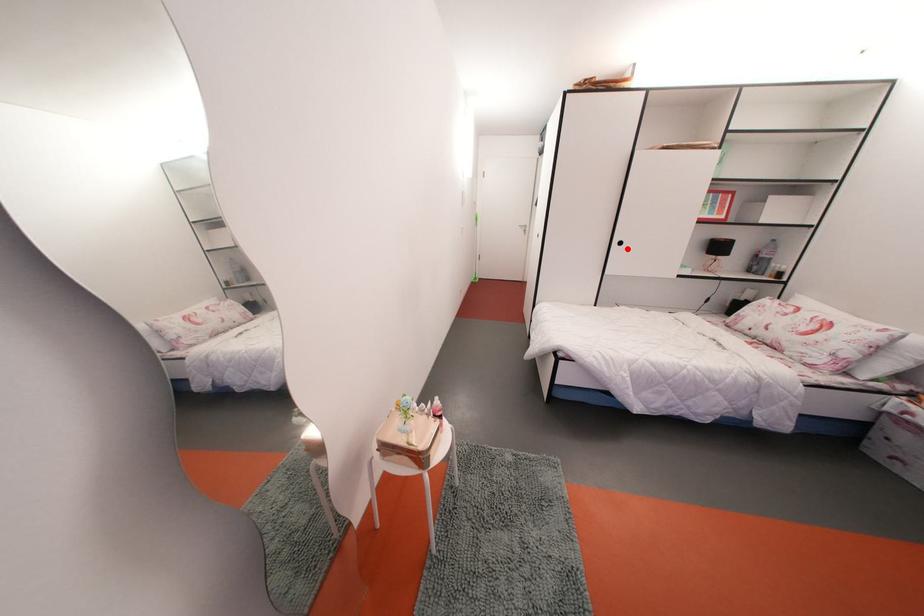
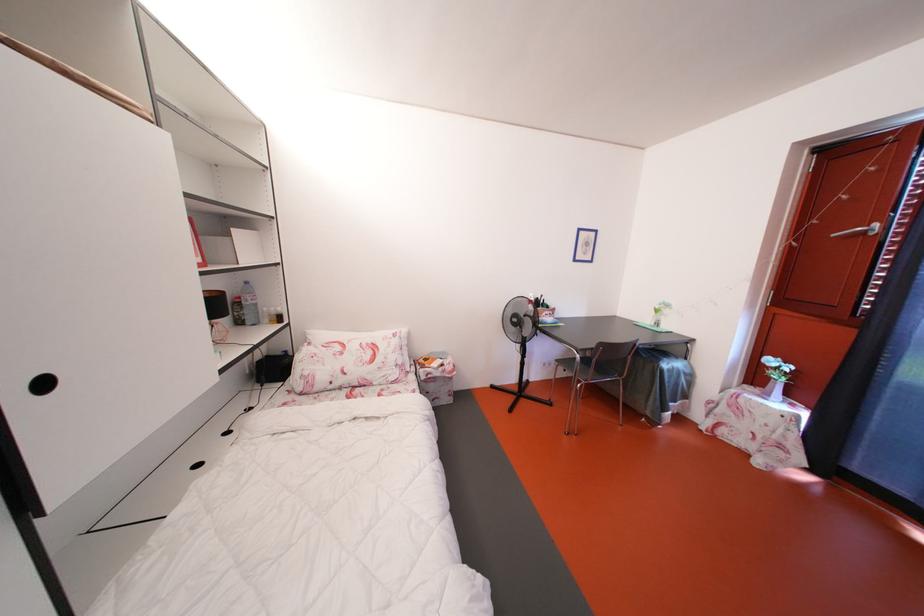
Question: I am providing you with two images of the same scene from different viewpoints. A red point is shown in image1. For the corresponding object point in image2, is it positioned nearer or farther from the camera?

Choices:
 (A) Nearer
 (B) Farther

Answer: (B)